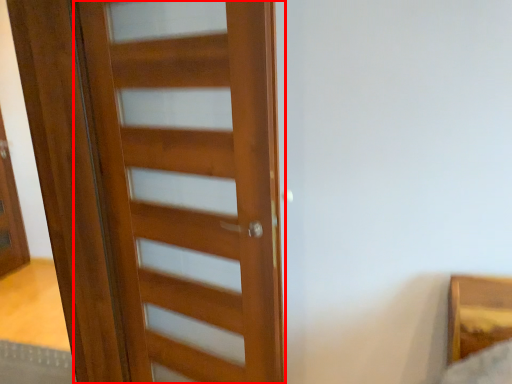
Question: From the image's perspective, where is door (annotated by the red box) located relative to screen door?

Choices:
 (A) above
 (B) below

Answer: (B)